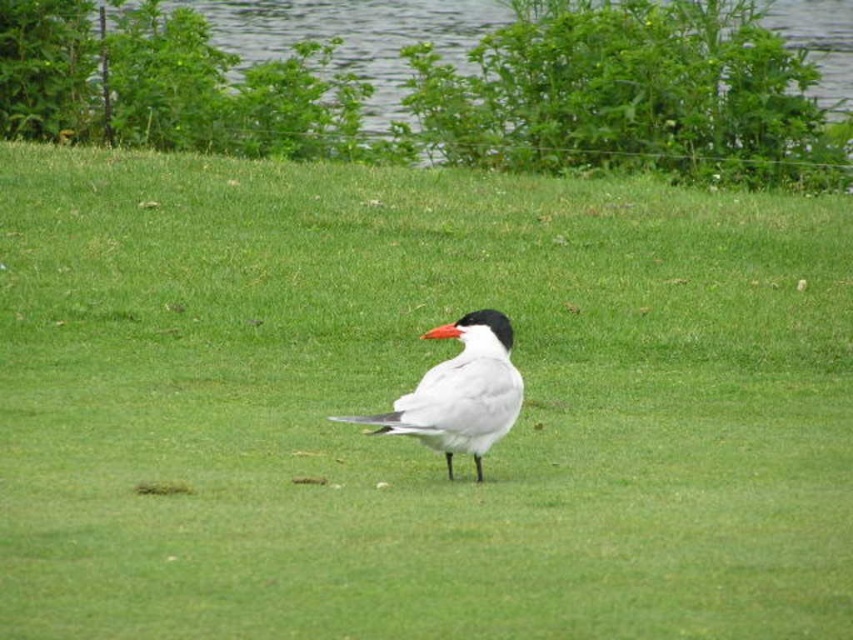
Question: Does green grass at upper center have a lesser width compared to white glossy bird at center?

Choices:
 (A) no
 (B) yes

Answer: (B)

Question: From the image, what is the correct spatial relationship of green grass at upper center in relation to white glossy bird at center?

Choices:
 (A) right
 (B) left

Answer: (A)

Question: Is green grass at upper center below white glossy bird at center?

Choices:
 (A) yes
 (B) no

Answer: (B)

Question: Which object appears closest to the camera in this image?

Choices:
 (A) green grass at upper center
 (B) white glossy bird at center

Answer: (B)

Question: Among these points, which one is farthest from the camera?

Choices:
 (A) (570, 4)
 (B) (468, 333)

Answer: (A)

Question: Which point appears closest to the camera in this image?

Choices:
 (A) (724, 131)
 (B) (466, 392)

Answer: (B)